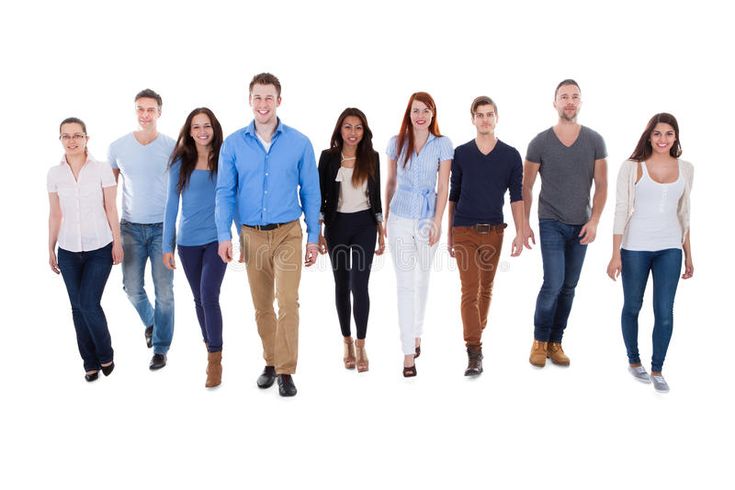
In order to click on chest in this screenshot , I will do `click(662, 179)`, `click(564, 151)`, `click(484, 165)`, `click(417, 161)`, `click(348, 172)`, `click(268, 162)`, `click(204, 174)`, `click(146, 162)`, `click(71, 186)`.